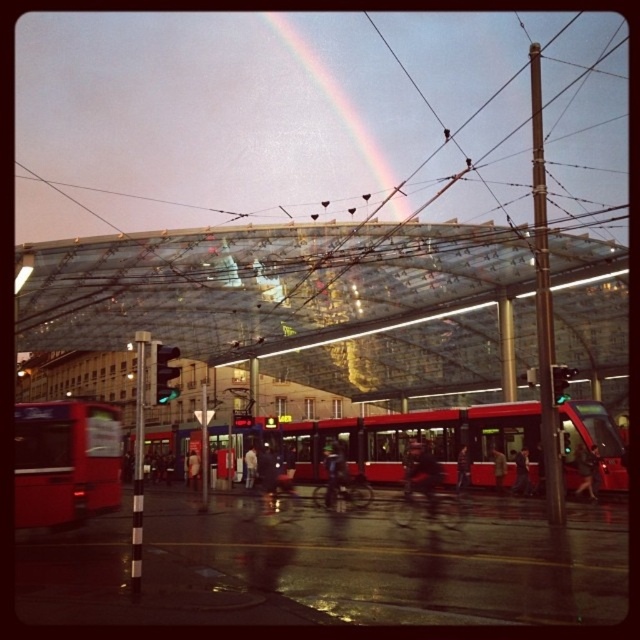
Does point (291, 445) come closer to viewer compared to point (99, 435)?

No, (291, 445) is further to viewer.

Where is `red matte articulated bus at center`? The image size is (640, 640). red matte articulated bus at center is located at coordinates (419, 440).

Between transparent glass railway station at center and red matte articulated bus at center, which one is positioned higher?

transparent glass railway station at center

Between point (499, 369) and point (509, 483), which one is positioned in front?

Point (509, 483) is in front.

This screenshot has height=640, width=640. In order to click on transparent glass railway station at center in this screenshot , I will do `click(305, 429)`.

Can you confirm if transparent glass railway station at center is positioned to the right of matte red bus at left?

Incorrect, transparent glass railway station at center is not on the right side of matte red bus at left.

Consider the image. Who is lower down, transparent glass railway station at center or matte red bus at left?

transparent glass railway station at center is lower down.

Is point (385, 570) farther from viewer compared to point (74, 444)?

No, it is not.

The height and width of the screenshot is (640, 640). Identify the location of transparent glass railway station at center. (305, 429).